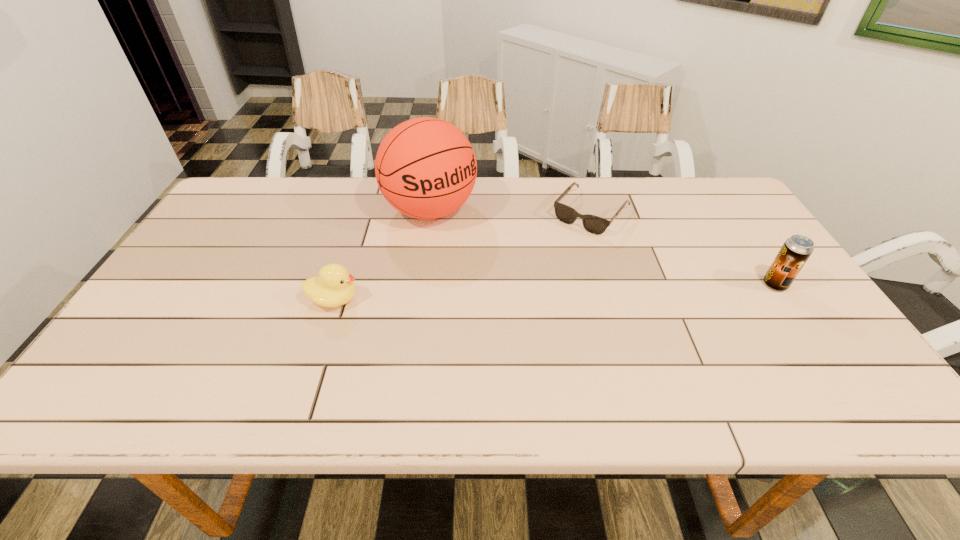
Locate an element on the screen. The width and height of the screenshot is (960, 540). vacant space located on the side with logo of the basketball is located at coordinates tap(506, 289).

Find the location of `free spot located at the front lenses of the shortest object`. free spot located at the front lenses of the shortest object is located at coordinates (501, 318).

Where is `vacant space located 0.320m at the front lenses of the shortest object`? Image resolution: width=960 pixels, height=540 pixels. vacant space located 0.320m at the front lenses of the shortest object is located at coordinates (516, 300).

The height and width of the screenshot is (540, 960). Find the location of `vacant area located at the front lenses of the shortest object`. vacant area located at the front lenses of the shortest object is located at coordinates (565, 242).

Identify the location of basketball that is positioned at the far edge. This screenshot has height=540, width=960. (426, 168).

You are a GUI agent. You are given a task and a screenshot of the screen. Output one action in this format:
    pyautogui.click(x=<x>, y=<y>)
    Task: Click on the sunglasses at the far edge
    The width and height of the screenshot is (960, 540).
    Given the screenshot: What is the action you would take?
    pyautogui.click(x=596, y=225)

I want to click on object that is at the right edge, so click(x=796, y=250).

Identify the location of vacant space at the far edge of the desktop. This screenshot has width=960, height=540. (552, 194).

Find the location of a particular element. The image size is (960, 540). vacant area at the near edge of the desktop is located at coordinates (248, 354).

Where is `free point at the left edge`? This screenshot has height=540, width=960. free point at the left edge is located at coordinates (226, 254).